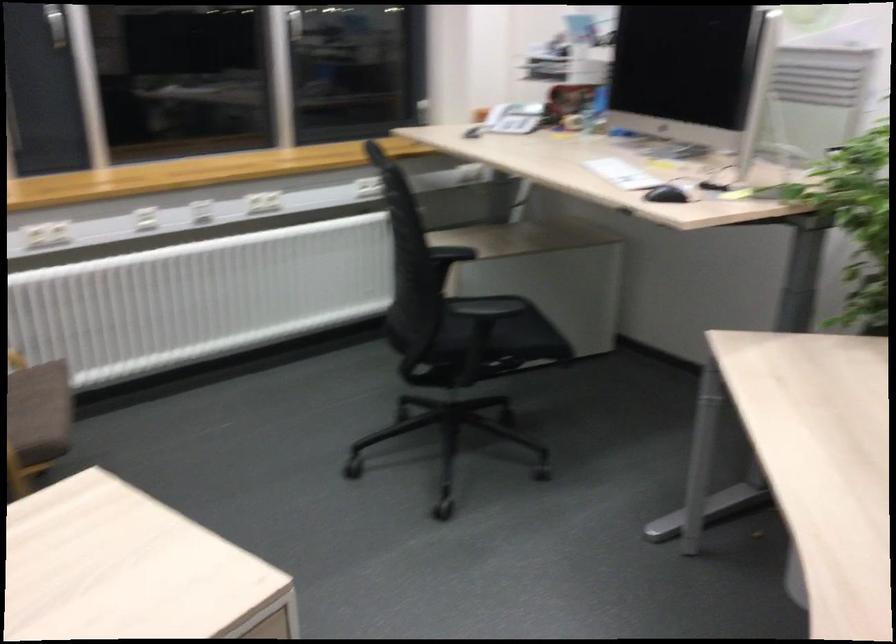
In order to click on white keyboard in this screenshot , I will do `click(622, 174)`.